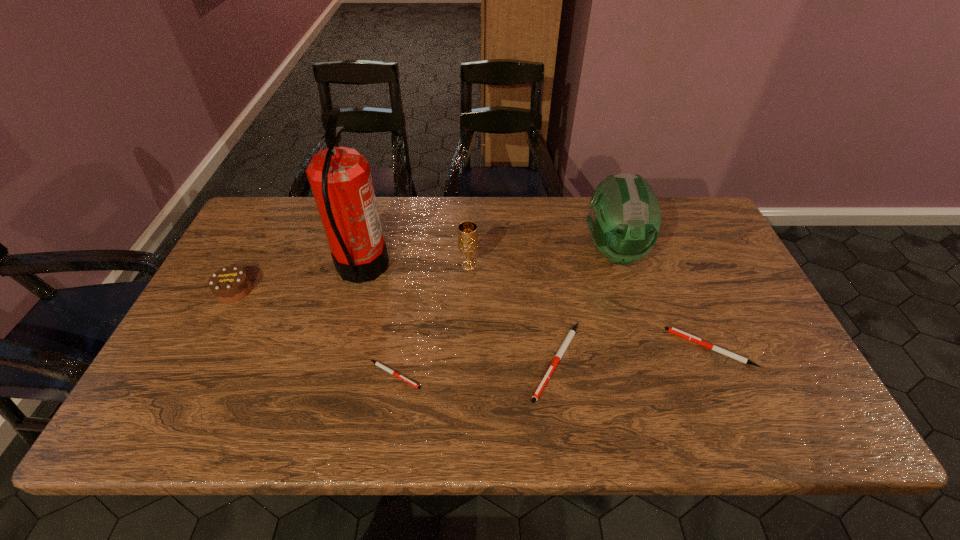
Locate an element on the screen. This screenshot has height=540, width=960. the leftmost pen is located at coordinates (378, 364).

Where is `the shortest object`? The width and height of the screenshot is (960, 540). the shortest object is located at coordinates pos(378,364).

Where is `the fifth object from left to right`? The image size is (960, 540). the fifth object from left to right is located at coordinates (566, 342).

Where is `the second shortest pen`? This screenshot has height=540, width=960. the second shortest pen is located at coordinates (675, 331).

Find the location of a particular element. This screenshot has height=540, width=960. the rightmost pen is located at coordinates (675, 331).

Where is `the tallest object`? This screenshot has width=960, height=540. the tallest object is located at coordinates (340, 178).

Find the location of a particular element. The image size is (960, 540). the sixth object from right to left is located at coordinates (340, 178).

This screenshot has width=960, height=540. What are the coordinates of `the sixth shortest object` in the screenshot? It's located at (624, 220).

Where is `the fourth object from right to left`? the fourth object from right to left is located at coordinates (467, 231).

You are a GUI agent. You are given a task and a screenshot of the screen. Output one action in this format:
    pyautogui.click(x=<x>, y=<y>)
    Task: Click on the chalice
    The width and height of the screenshot is (960, 540).
    Given the screenshot: What is the action you would take?
    pyautogui.click(x=467, y=231)